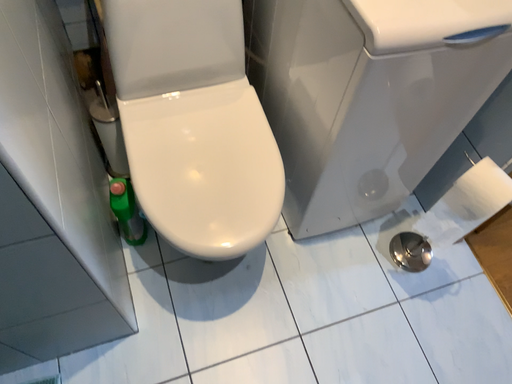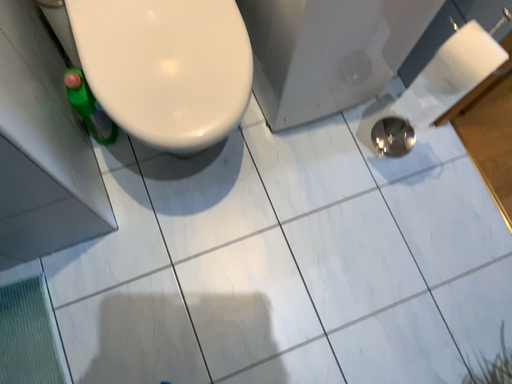
Question: Which way did the camera rotate in the video?

Choices:
 (A) rotated upward
 (B) rotated downward

Answer: (B)